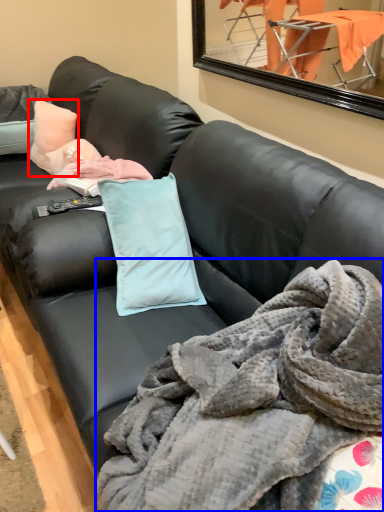
Question: Which object is further to the camera taking this photo, pillow (highlighted by a red box) or blanket (highlighted by a blue box)?

Choices:
 (A) pillow
 (B) blanket

Answer: (A)